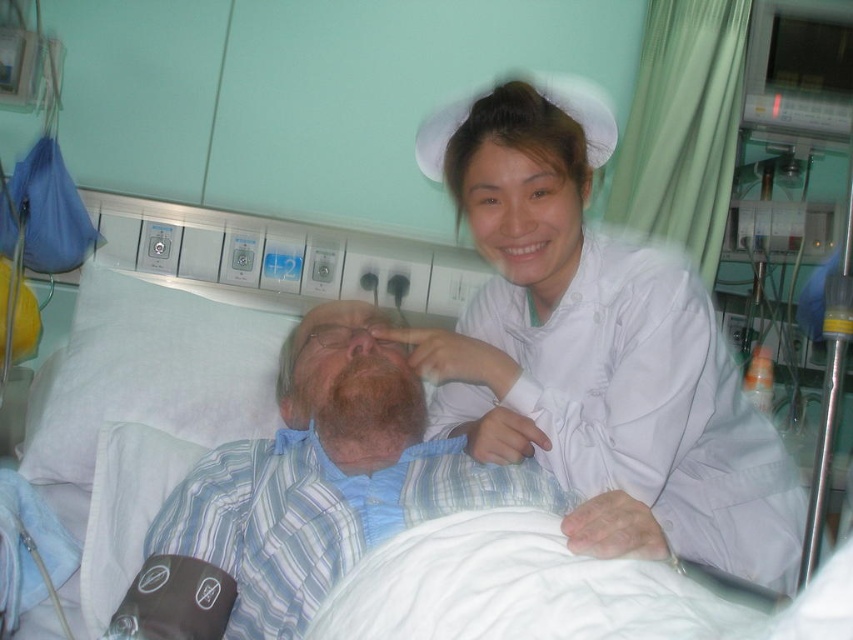
Question: Can you confirm if white smooth nurse cap at upper center is wider than blue striped shirt at center?

Choices:
 (A) yes
 (B) no

Answer: (A)

Question: Which of the following is the closest to the observer?

Choices:
 (A) (299, 406)
 (B) (206, 230)
 (C) (602, 285)

Answer: (C)

Question: Which point is farther to the camera?

Choices:
 (A) (630, 508)
 (B) (148, 493)
 (C) (265, 449)

Answer: (B)

Question: Is white smooth nurse cap at upper center positioned at the back of white fabric hospital bed at center?

Choices:
 (A) no
 (B) yes

Answer: (A)

Question: Which point is closer to the camera?

Choices:
 (A) coord(231,609)
 (B) coord(154,360)
 (C) coord(465,404)

Answer: (A)

Question: Where is white fabric hospital bed at center located in relation to blue striped shirt at center in the image?

Choices:
 (A) below
 (B) above

Answer: (B)